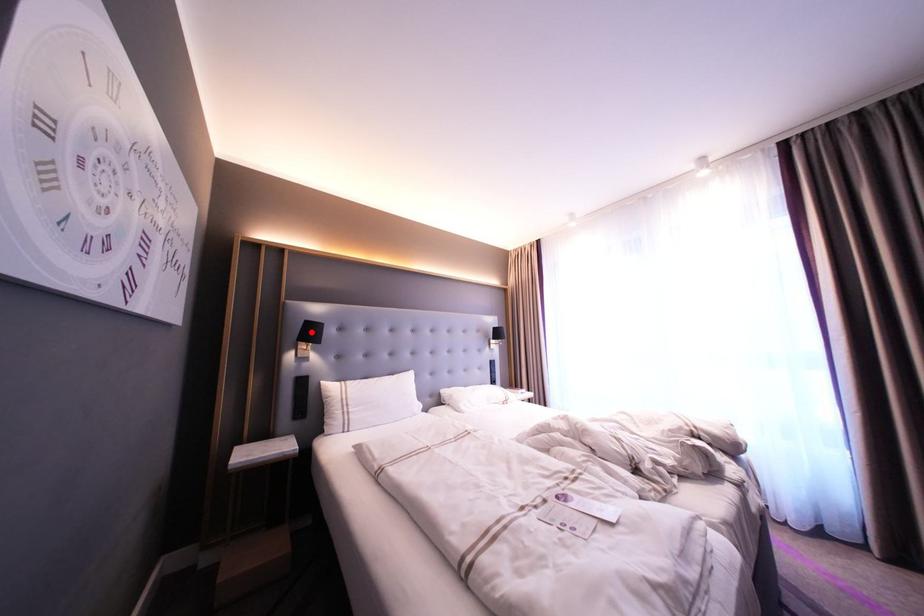
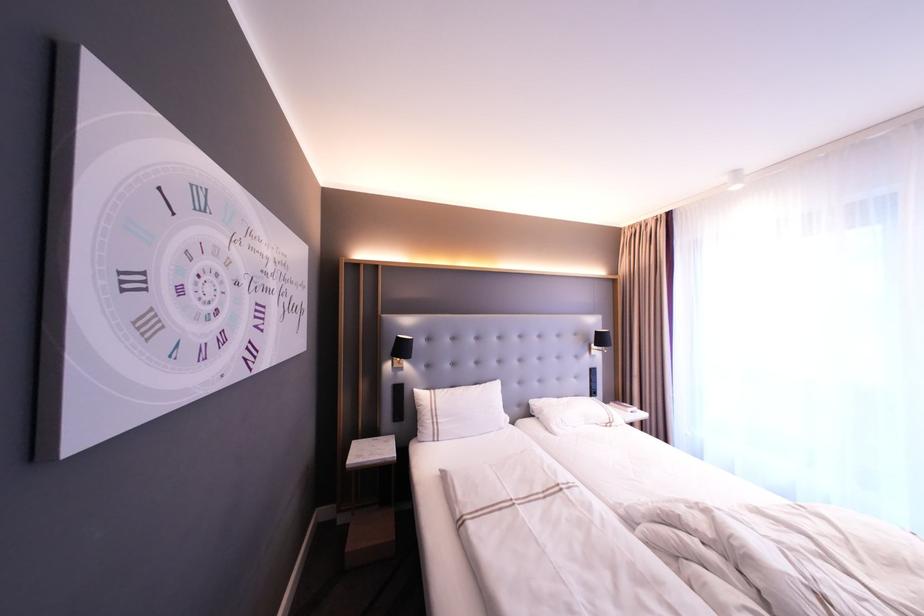
In the second image, find the point that corresponds to the highlighted location in the first image.

(402, 349)